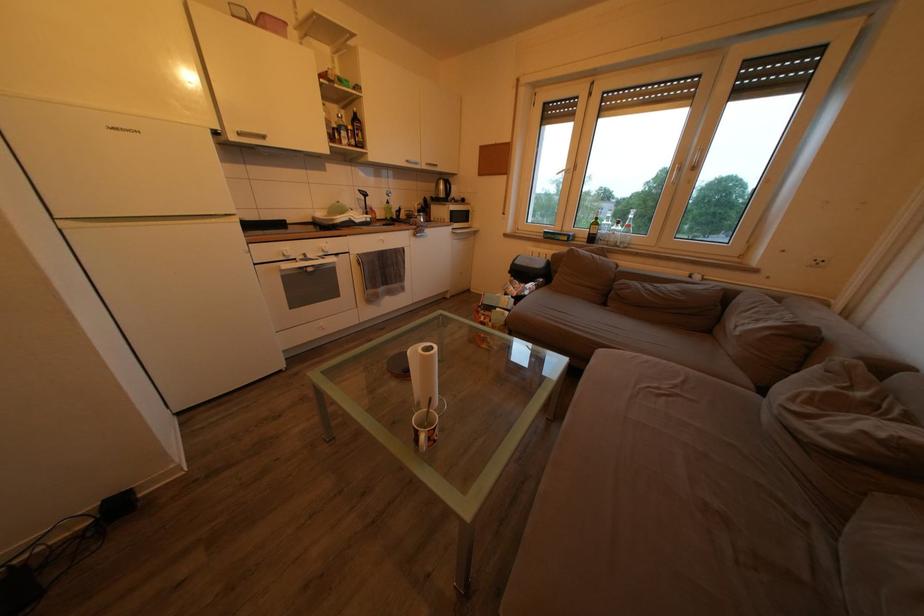
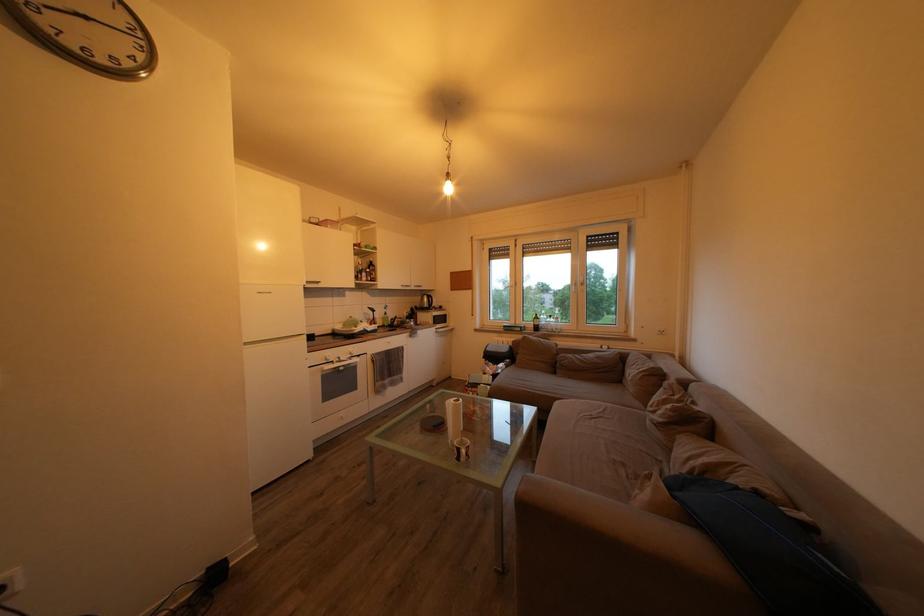
The point at (423, 211) is marked in the first image. Where is the corresponding point in the second image?

(412, 318)